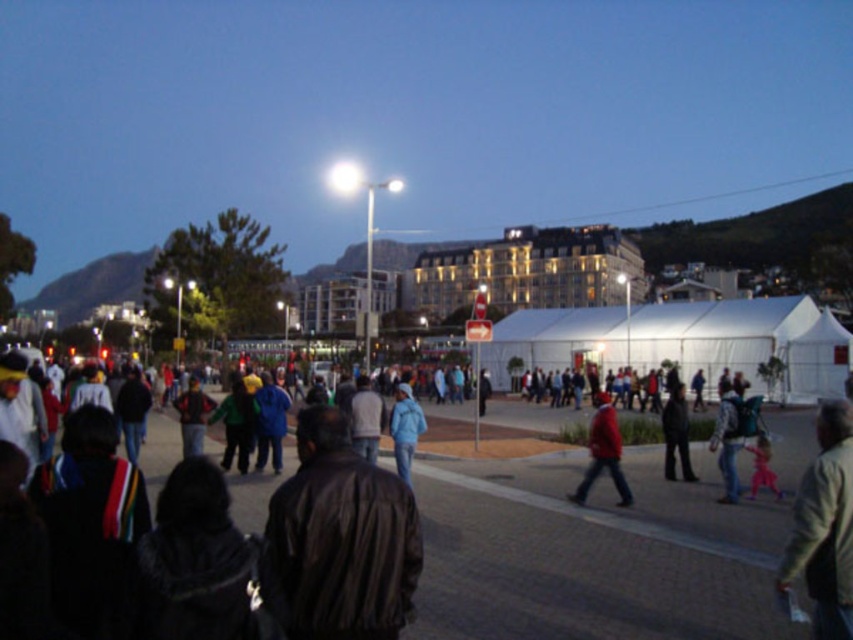
Who is positioned more to the right, matte red jacket at center or blue matte jacket at center?

Positioned to the right is matte red jacket at center.

Who is lower down, matte red jacket at center or blue matte jacket at center?

matte red jacket at center is below.

Is point (602, 390) closer to viewer compared to point (405, 413)?

No, it is not.

Identify the location of matte red jacket at center. This screenshot has width=853, height=640. (602, 452).

Is white fabric tent at center to the left of matte red jacket at center from the viewer's perspective?

No, white fabric tent at center is not to the left of matte red jacket at center.

Which is in front, point (726, 340) or point (602, 424)?

Point (602, 424) is more forward.

You are a GUI agent. You are given a task and a screenshot of the screen. Output one action in this format:
    pyautogui.click(x=<x>, y=<y>)
    Task: Click on the white fabric tent at center
    
    Given the screenshot: What is the action you would take?
    pyautogui.click(x=682, y=340)

Can you confirm if white fabric tent at center is positioned above blue matte jacket at center?

Yes, white fabric tent at center is above blue matte jacket at center.

Which is in front, point (755, 316) or point (401, 385)?

Point (401, 385) is in front.

Where is `white fabric tent at center`? The height and width of the screenshot is (640, 853). white fabric tent at center is located at coordinates (682, 340).